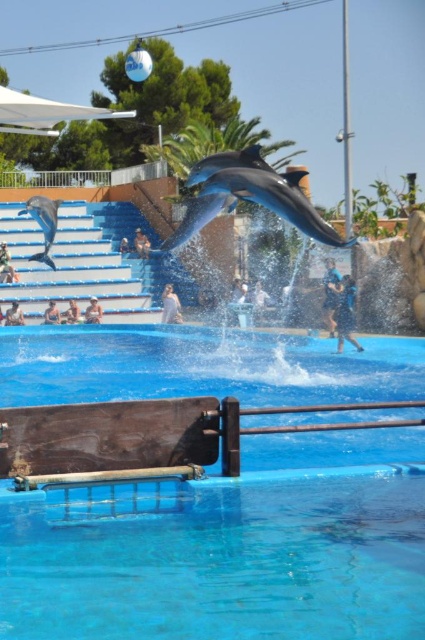
Question: Estimate the real-world distances between objects in this image. Which object is closer to the blue fabric trainer at center?

Choices:
 (A) smooth gray dolphin at left
 (B) shiny gray dolphin at center

Answer: (B)

Question: Where is shiny gray dolphin at center located in relation to smooth gray dolphin at left in the image?

Choices:
 (A) left
 (B) right

Answer: (B)

Question: Is shiny gray dolphin at center positioned behind blue fabric trainer at center?

Choices:
 (A) no
 (B) yes

Answer: (A)

Question: Which point is closer to the camera taking this photo?

Choices:
 (A) (302, 392)
 (B) (243, 154)

Answer: (B)

Question: Which of the following is the closest to the observer?

Choices:
 (A) smooth gray dolphin at left
 (B) shiny gray dolphin at center
 (C) blue smooth water at center

Answer: (C)

Question: Does shiny gray dolphin at center come in front of blue fabric trainer at center?

Choices:
 (A) no
 (B) yes

Answer: (B)